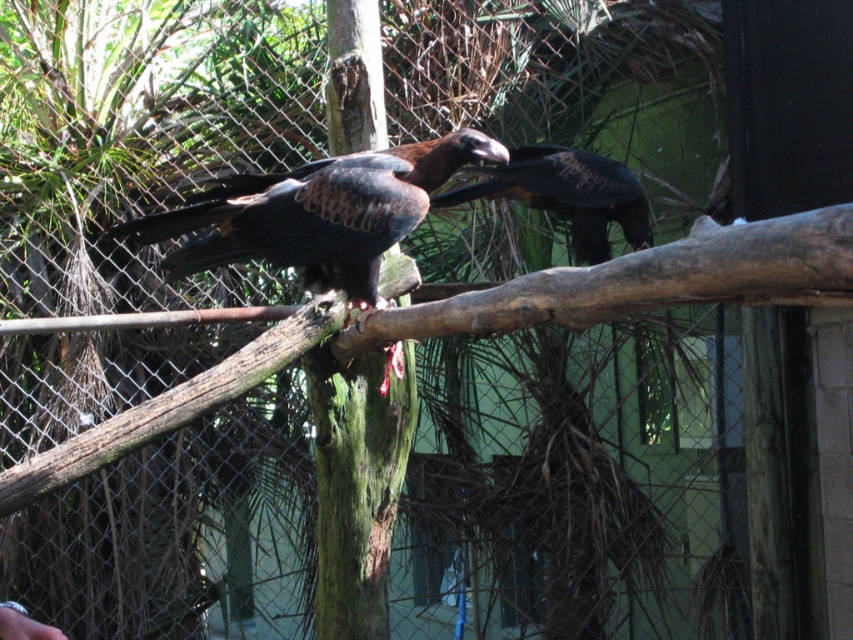
Based on the photo, you are a zookeeper planning to place a small feeding tray for the birds. The tray must be placed exactly at the point marked as point (491, 323). What material should the feeding tray be made of to blend in with the environment at that specific location?

The feeding tray should be made of brown rough wood to match the brown rough wood at center located at point (491, 323).

You are a zookeeper trying to place a new feeding tray for the birds. The tray must be placed exactly at the center of the enclosure. The enclosure is a rectangle with coordinates from 0 to 1 on both axes. Where should the feeding tray be placed relative to the brown rough wood at center?

The feeding tray should be placed at the center of the enclosure, which is at point (426, 320). The brown rough wood at center is located at (491, 323), so the tray should be placed slightly to the left and above the brown rough wood at center to reach the exact center.

In the scene shown: You are a zookeeper observing the two large birds in the enclosure. You notice the dark brown feathers at center and the shiny dark brown eagle at center. Which object is positioned more to the left?

The dark brown feathers at center is positioned to the left of the shiny dark brown eagle at center.